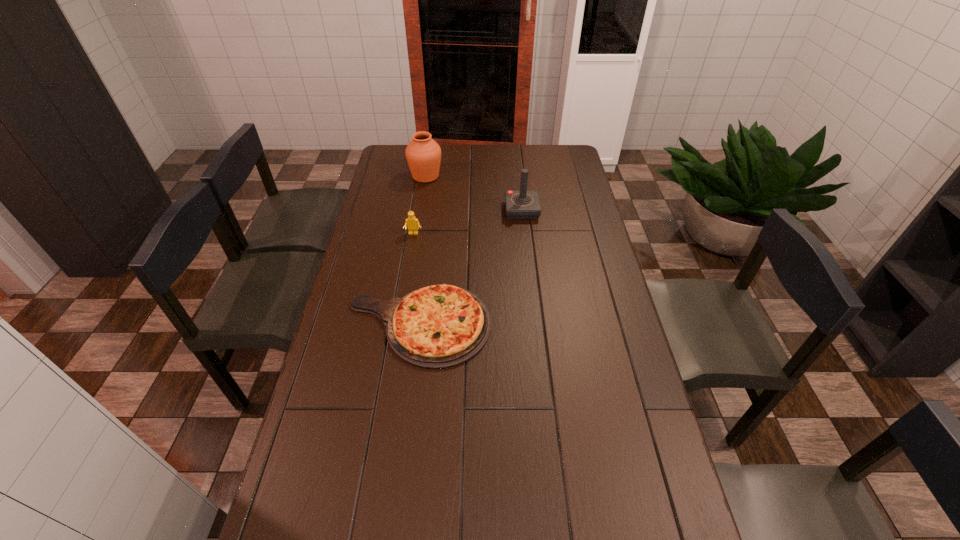
The height and width of the screenshot is (540, 960). I want to click on urn, so click(x=423, y=154).

Where is `the third nearest object`? The image size is (960, 540). the third nearest object is located at coordinates (520, 204).

This screenshot has height=540, width=960. I want to click on the rightmost object, so click(520, 204).

Locate an element on the screen. The height and width of the screenshot is (540, 960). Lego is located at coordinates (411, 222).

Locate an element on the screen. the second nearest object is located at coordinates (411, 222).

Find the location of a particular element. This screenshot has width=960, height=540. pizza is located at coordinates (440, 326).

You are a GUI agent. You are given a task and a screenshot of the screen. Output one action in this format:
    pyautogui.click(x=<x>, y=<y>)
    Task: Click on the nearest object
    
    Given the screenshot: What is the action you would take?
    point(440,326)

At what (x,y) coordinates should I click in order to perform the action: click on free space located on the front of the urn. Please return your answer as a coordinate pair (x, y). The height and width of the screenshot is (540, 960). Looking at the image, I should click on tap(420, 217).

Find the location of a particular element. vacant area situated 0.210m on the rectangular base of the rightmost object is located at coordinates (527, 255).

Find the location of a particular element. vacant area located 0.310m on the face of the second shortest object is located at coordinates (403, 294).